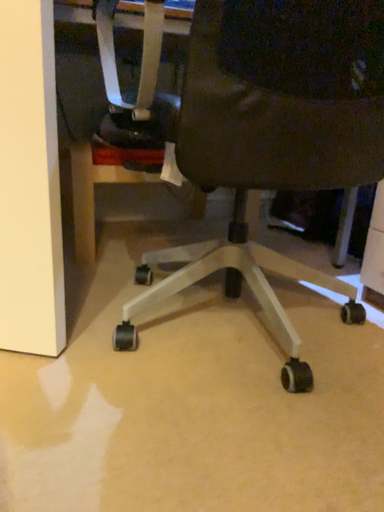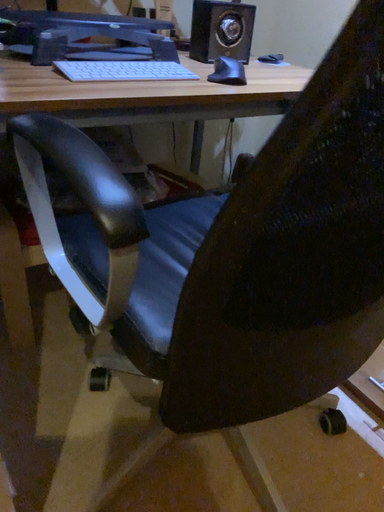
Question: How did the camera likely rotate when shooting the video?

Choices:
 (A) rotated downward
 (B) rotated upward

Answer: (A)